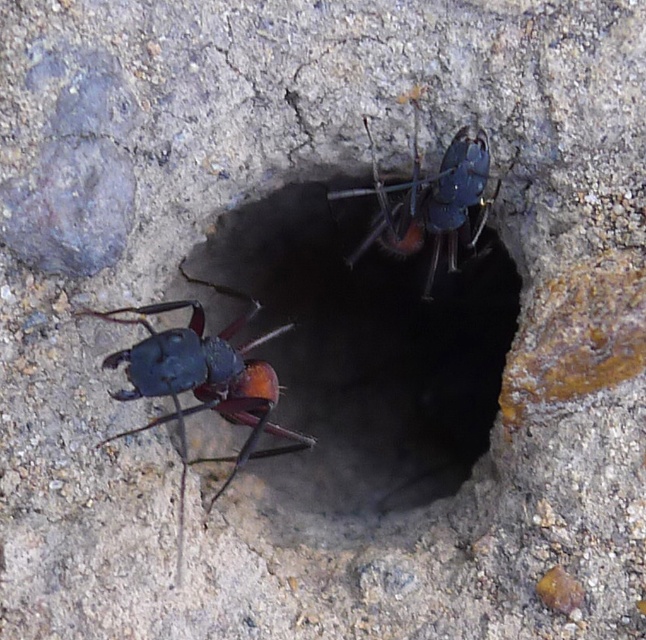
Does smooth concrete hole at center appear over shiny blue ant at upper center?

No.

Does smooth concrete hole at center lie in front of shiny blue ant at upper center?

No.

Which is in front, point (298, 424) or point (401, 252)?

Point (401, 252) is in front.

Locate an element on the screen. The height and width of the screenshot is (640, 646). smooth concrete hole at center is located at coordinates (366, 348).

Between smooth concrete hole at center and shiny black ant at left, which one has more height?

Standing taller between the two is smooth concrete hole at center.

Can you confirm if smooth concrete hole at center is positioned above shiny black ant at left?

Indeed, smooth concrete hole at center is positioned over shiny black ant at left.

I want to click on smooth concrete hole at center, so click(366, 348).

The image size is (646, 640). Identify the location of smooth concrete hole at center. (366, 348).

Describe the element at coordinates (202, 381) in the screenshot. This screenshot has width=646, height=640. I see `shiny black ant at left` at that location.

Identify the location of shiny black ant at left. (202, 381).